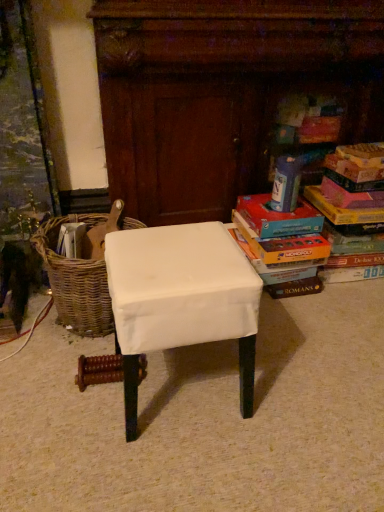
At what (x,y) coordinates should I click in order to perform the action: click on free spot in front of hardcover book at upper right. Please return your answer as a coordinate pair (x, y). Looking at the image, I should click on (280, 217).